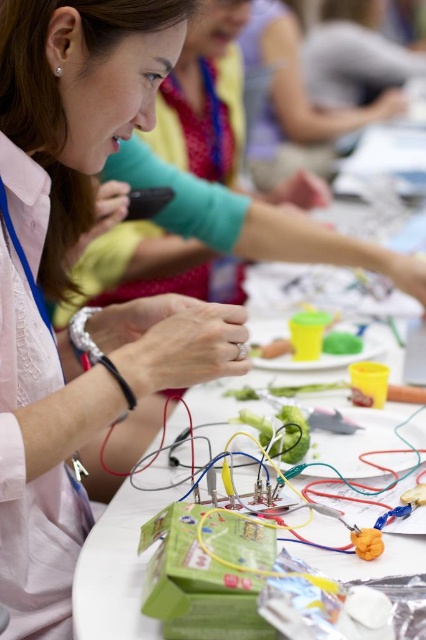
Looking at the scene, which object is positioned higher between the white paper at center and the matte green shirt at upper center?

The matte green shirt at upper center is positioned higher than the white paper at center.

You are a participant in the workshop and need to place a 40 cm long tool between the matte pink shirt at center and the white paper at center. Will the tool fit in the space between them?

The distance between the matte pink shirt at center and the white paper at center is 39.38 centimeters, which is slightly shorter than the 40 cm tool. Therefore, the tool will not fit in the space between them.

You are an observer in the classroom and notice two people wearing the matte pink shirt at center and the matte green shirt at upper center. Which person is wearing a smaller shirt?

The matte pink shirt at center is smaller than the matte green shirt at upper center, so the person wearing the matte pink shirt at center has the smaller one.